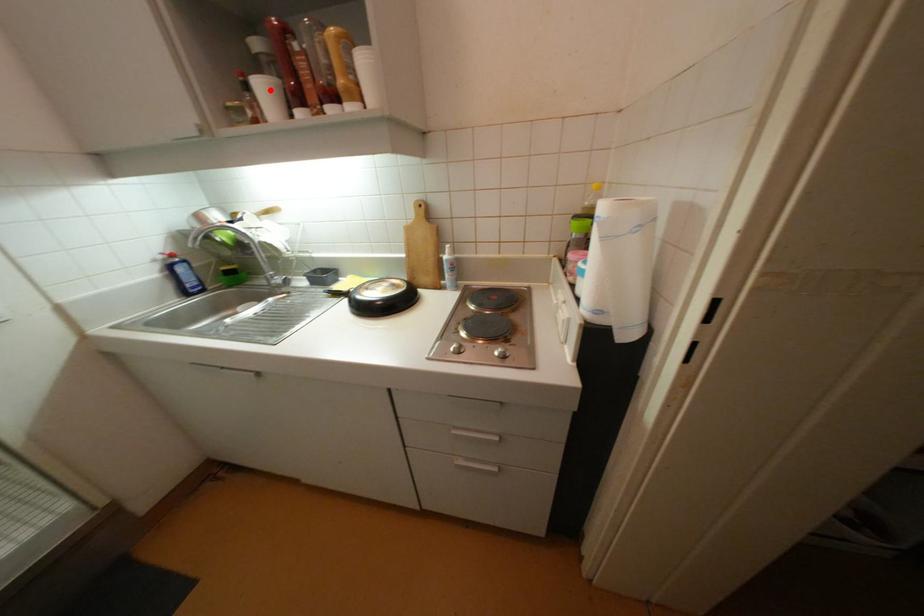
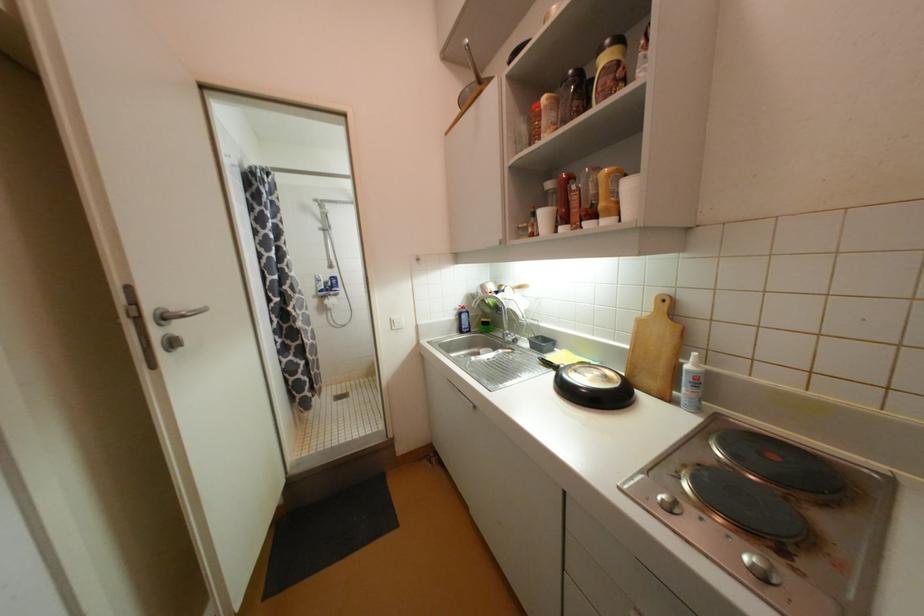
Where in the second image is the point corresponding to the highlighted location from the first image?

(550, 216)